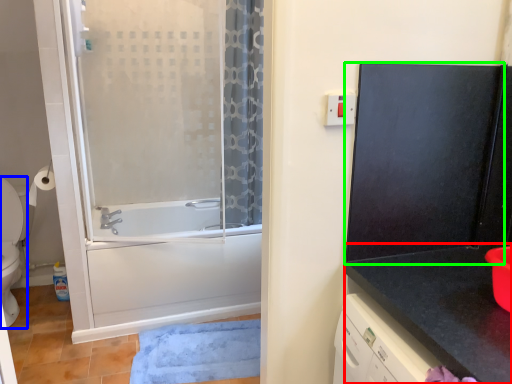
Question: Which object is positioned farthest from counter top (highlighted by a red box)? Select from toilet (highlighted by a blue box) and screen door (highlighted by a green box).

Choices:
 (A) toilet
 (B) screen door

Answer: (A)